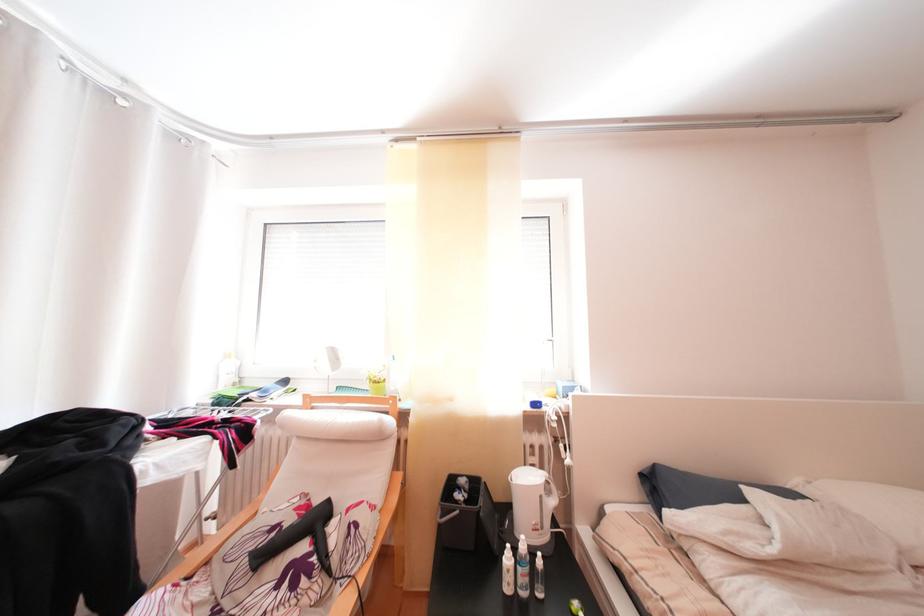
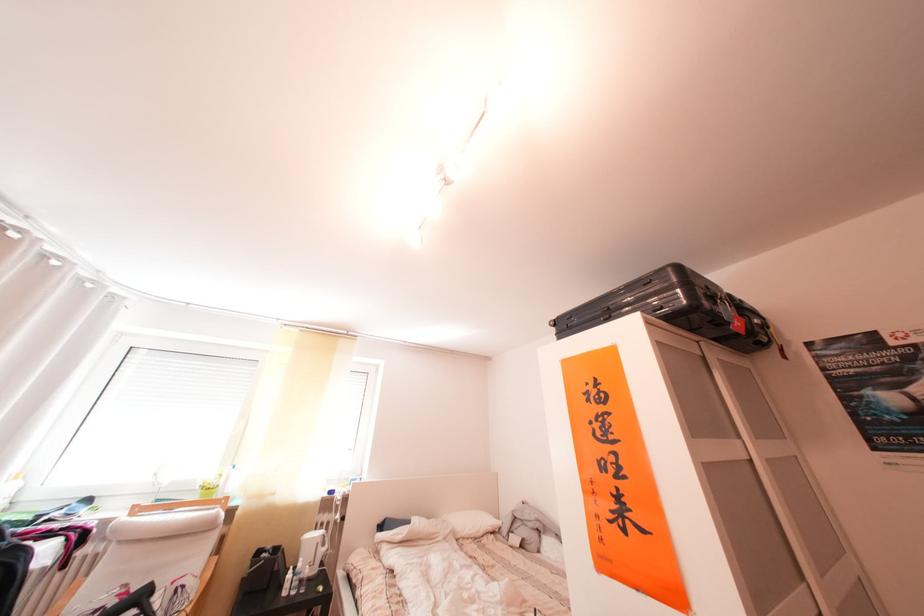
Where in the second image is the point corresponding to point 536,553 from the first image?

(312, 570)